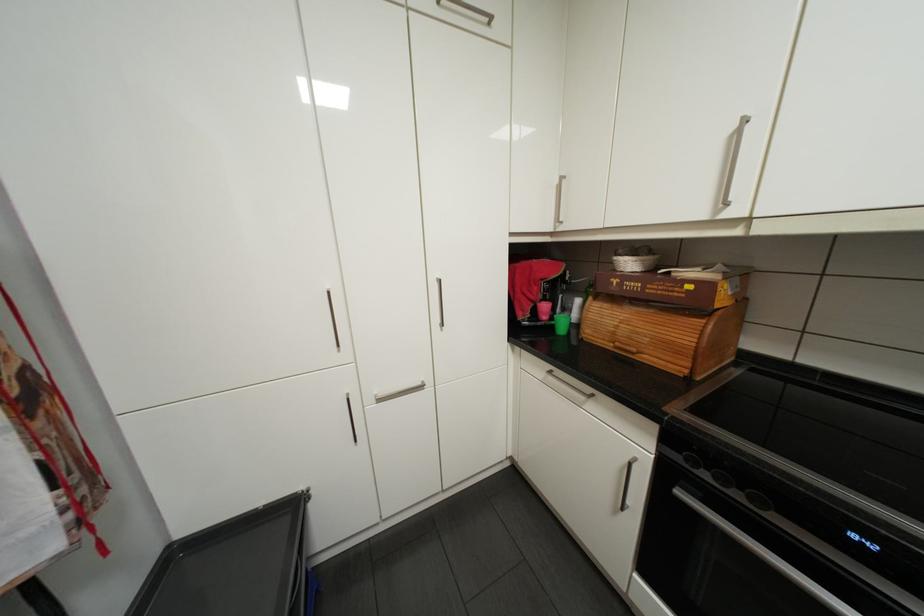
The location [233,565] corresponds to which object?

It refers to a black baking tray.